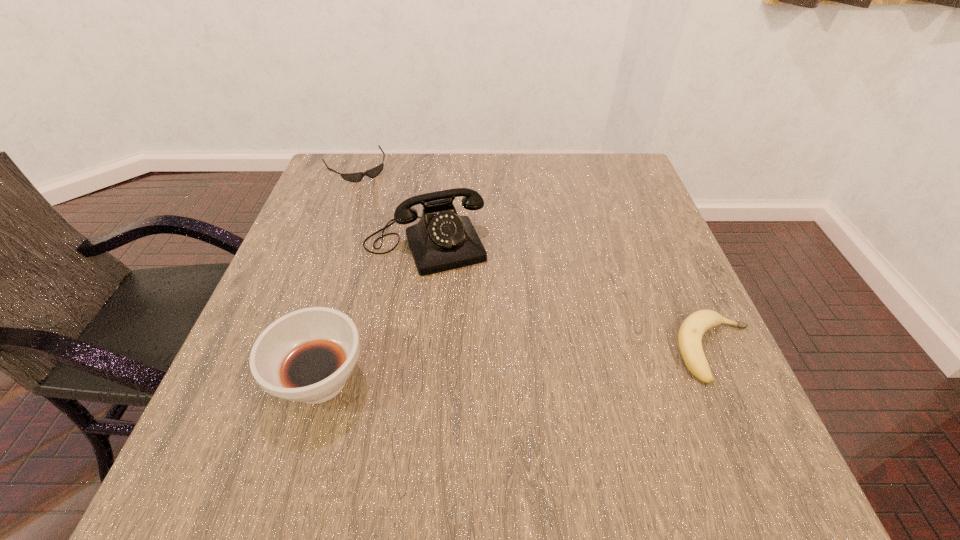
Where is `object that is at the right edge`? object that is at the right edge is located at coordinates (692, 329).

Identify the location of object at the far left corner. The height and width of the screenshot is (540, 960). (372, 173).

I want to click on object that is at the near left corner, so click(307, 355).

What are the coordinates of `object that is at the near right corner` in the screenshot? It's located at (692, 329).

What are the coordinates of `vacant space at the far edge of the desktop` in the screenshot? It's located at (568, 192).

Identify the location of free space at the near edge. The height and width of the screenshot is (540, 960). (x=468, y=422).

The image size is (960, 540). What are the coordinates of `free space at the left edge` in the screenshot? It's located at (344, 222).

Locate an element on the screen. The height and width of the screenshot is (540, 960). blank space at the right edge is located at coordinates (617, 217).

Find the location of `free space at the far left corner of the desktop`. free space at the far left corner of the desktop is located at coordinates (355, 168).

Locate an element on the screen. Image resolution: width=960 pixels, height=540 pixels. free space at the far right corner of the desktop is located at coordinates (618, 169).